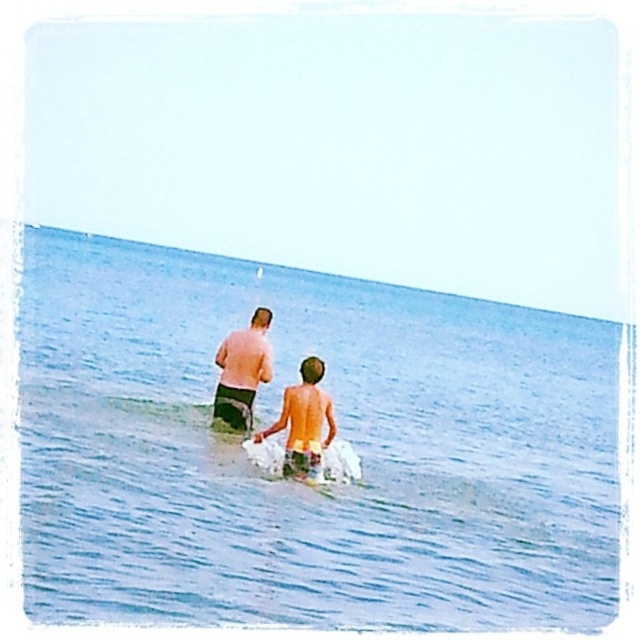
Who is positioned more to the right, matte black shorts at center or tan skin boy at center?

Positioned to the right is tan skin boy at center.

Can you confirm if matte black shorts at center is positioned to the left of tan skin boy at center?

Yes, matte black shorts at center is to the left of tan skin boy at center.

The width and height of the screenshot is (640, 640). Describe the element at coordinates (243, 371) in the screenshot. I see `matte black shorts at center` at that location.

At what (x,y) coordinates should I click in order to perform the action: click on matte black shorts at center. Please return your answer as a coordinate pair (x, y). The image size is (640, 640). Looking at the image, I should click on click(x=243, y=371).

From the picture: Between blue water at center and tan skin boy at center, which one is positioned higher?

blue water at center is above.

How far apart are blue water at center and tan skin boy at center?

9.62 meters

Does point (616, 525) come closer to viewer compared to point (317, 424)?

No.

What are the coordinates of `blue water at center` in the screenshot? It's located at (337, 436).

Between blue water at center and matte black shorts at center, which one has more height?

blue water at center

Does blue water at center have a smaller size compared to matte black shorts at center?

No.

Where is `blue water at center`? blue water at center is located at coordinates (337, 436).

The width and height of the screenshot is (640, 640). I want to click on blue water at center, so pos(337,436).